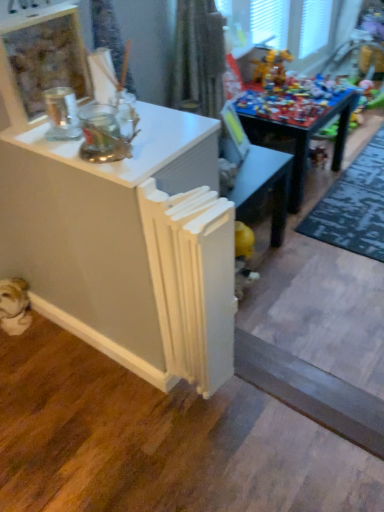
Find the location of a particular element. Image resolution: width=384 pixels, height=512 pixels. vacant space situated above wooden toy at center (from a real-world perspective) is located at coordinates (294, 94).